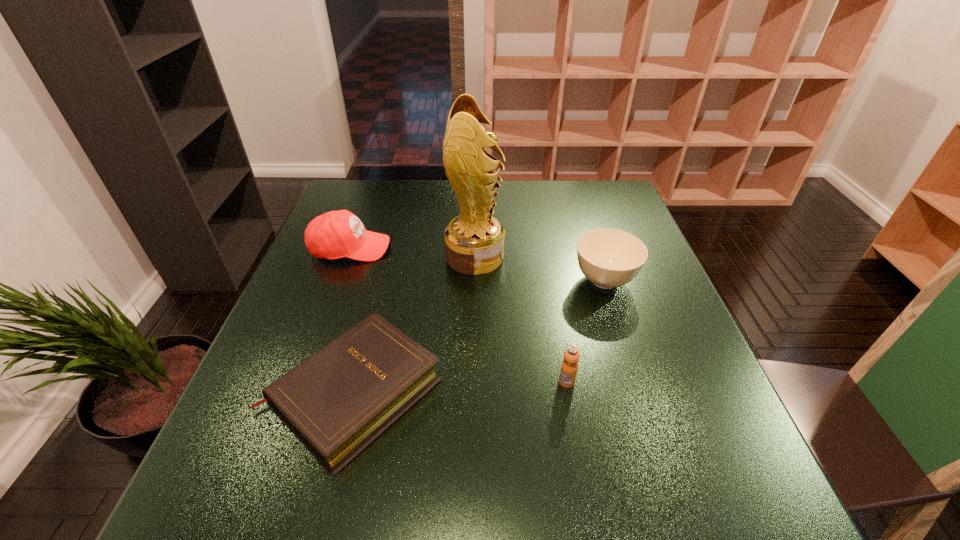
What are the coordinates of `object present at the near edge` in the screenshot? It's located at (337, 401).

Locate an element on the screen. baseball cap that is at the left edge is located at coordinates (336, 234).

What are the coordinates of `Bible that is at the left edge` in the screenshot? It's located at (337, 401).

Find the location of a particular element. The height and width of the screenshot is (540, 960). object situated at the right edge is located at coordinates (609, 258).

The width and height of the screenshot is (960, 540). Identify the location of object at the near left corner. (337, 401).

Where is `blank space at the far edge of the desktop`? blank space at the far edge of the desktop is located at coordinates (529, 201).

The width and height of the screenshot is (960, 540). I want to click on free space at the near edge, so click(x=460, y=528).

Where is `blank space at the right edge`? The height and width of the screenshot is (540, 960). blank space at the right edge is located at coordinates (640, 319).

Where is `free spot at the far right corner of the desktop`? This screenshot has width=960, height=540. free spot at the far right corner of the desktop is located at coordinates (578, 188).

Locate an element on the screen. Image resolution: width=960 pixels, height=540 pixels. free point at the near right corner is located at coordinates (747, 475).